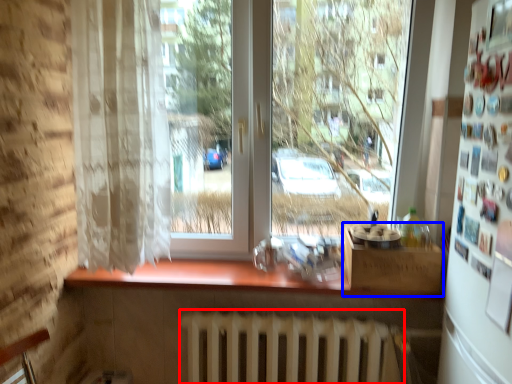
Question: Which point is closer to the camera, radiator (highlighted by a red box) or window box (highlighted by a blue box)?

Choices:
 (A) radiator
 (B) window box

Answer: (A)